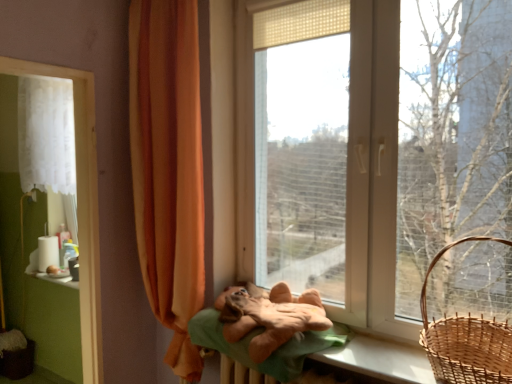
Measure the distance between point (168, 268) and camera.

The depth of point (168, 268) is 7.12 feet.

Measure the distance between transparent plastic window at center and camera.

5.52 feet.

What do you see at coordinates (46, 134) in the screenshot? The height and width of the screenshot is (384, 512). I see `white sheer curtain at left, which appears as the first curtain when viewed from the back` at bounding box center [46, 134].

I want to click on white sheer curtain at left, acting as the second curtain starting from the right, so click(x=46, y=134).

You are a GUI agent. You are given a task and a screenshot of the screen. Output one action in this format:
    pyautogui.click(x=<x>, y=<y>)
    Task: Click on the woven brown basket at right
    
    Given the screenshot: What is the action you would take?
    pyautogui.click(x=466, y=340)

Which is farther, (470,356) or (382,268)?

The point (382,268) is behind.

What's the angular difference between woven brown basket at right and transparent plastic window at center's facing directions?

Result: There is a 0.000102-degree angle between the facing directions of woven brown basket at right and transparent plastic window at center.

From a real-world perspective, relative to transparent plastic window at center, is woven brown basket at right vertically above or below?

In terms of real-world spatial position, woven brown basket at right is below transparent plastic window at center.

Looking at their sizes, would you say woven brown basket at right is wider or thinner than transparent plastic window at center?

Clearly, woven brown basket at right has more width compared to transparent plastic window at center.

Considering the positions of objects orange fabric curtain at left, positioned as the 2th curtain in left-to-right order, and soft brown plush at center in the image provided, who is behind, orange fabric curtain at left, positioned as the 2th curtain in left-to-right order, or soft brown plush at center?

orange fabric curtain at left, positioned as the 2th curtain in left-to-right order, is behind.

Could you tell me if orange fabric curtain at left, the 2th curtain from the back, is turned towards soft brown plush at center?

No, orange fabric curtain at left, the 2th curtain from the back, does not turn towards soft brown plush at center.

Is orange fabric curtain at left, positioned as the 2th curtain in left-to-right order, surrounding soft brown plush at center?

That's incorrect, soft brown plush at center is not inside orange fabric curtain at left, positioned as the 2th curtain in left-to-right order.

You are a GUI agent. You are given a task and a screenshot of the screen. Output one action in this format:
    pyautogui.click(x=<x>, y=<y>)
    Task: Click on the curtain that is the 1st object located above the soft brown plush at center (from the image's perspective)
    This screenshot has width=512, height=384.
    Given the screenshot: What is the action you would take?
    pyautogui.click(x=168, y=168)

From the picture: Does white fabric at left contain woven brown basket at right?

Actually, woven brown basket at right is outside white fabric at left.

From the picture: From the image's perspective, which object appears higher, white fabric at left or woven brown basket at right?

white fabric at left, from the image's perspective.

Does white fabric at left have a greater width compared to woven brown basket at right?

In fact, white fabric at left might be narrower than woven brown basket at right.

Would you say white fabric at left is a long distance from woven brown basket at right?

Yes, white fabric at left and woven brown basket at right are quite far apart.

Looking at this image, is brown woven basket at lower left not inside white fabric at left?

Yes.

Is brown woven basket at lower left positioned behind white fabric at left?

Yes, brown woven basket at lower left is further from the camera.

Is brown woven basket at lower left in contact with white fabric at left?

brown woven basket at lower left is not next to white fabric at left, and they're not touching.

Can you confirm if brown woven basket at lower left is shorter than white fabric at left?

Correct, brown woven basket at lower left is not as tall as white fabric at left.

Is soft brown plush at center next to white fabric at left?

No, soft brown plush at center is not next to white fabric at left.

Considering the sizes of objects soft brown plush at center and white fabric at left in the image provided, who is taller, soft brown plush at center or white fabric at left?

Standing taller between the two is white fabric at left.

Where is `window frame above the soft brown plush at center (from the image's perspective)`? window frame above the soft brown plush at center (from the image's perspective) is located at coordinates (81, 206).

Is point (311, 303) more distant than point (98, 279)?

No.

What's the angular difference between white fabric at left and transparent plastic window at center's facing directions?

white fabric at left and transparent plastic window at center are facing 88.5 degrees away from each other.

From the image's perspective, who appears lower, white fabric at left or transparent plastic window at center?

white fabric at left appears lower in the image.

Are white fabric at left and transparent plastic window at center beside each other?

No.

Which is more to the right, white fabric at left or transparent plastic window at center?

Positioned to the right is transparent plastic window at center.

Considering the relative sizes of transparent plastic window at center and woven brown basket at right in the image provided, is transparent plastic window at center smaller than woven brown basket at right?

Actually, transparent plastic window at center might be larger than woven brown basket at right.

Looking at this image, is transparent plastic window at center wider or thinner than woven brown basket at right?

Clearly, transparent plastic window at center has less width compared to woven brown basket at right.

Is transparent plastic window at center far away from woven brown basket at right?

That's not correct — transparent plastic window at center is a little close to woven brown basket at right.

How different are the orientations of transparent plastic window at center and woven brown basket at right in degrees?

The facing directions of transparent plastic window at center and woven brown basket at right are 0.000102 degrees apart.

In order to click on window above the woven brown basket at right (from the image's perspective) in this screenshot , I will do `click(373, 173)`.

At what (x,y) coordinates should I click in order to perform the action: click on bed that is below the orange fabric curtain at left, positioned as the 2th curtain in left-to-right order (from the image's perspective). Please return your answer as a coordinate pair (x, y). This screenshot has height=384, width=512. Looking at the image, I should click on (267, 330).

Which object lies nearer to the anchor point soft brown plush at center, white fabric at left or white sheer curtain at left, acting as the second curtain starting from the right?

white fabric at left lies closer to soft brown plush at center than the other object.

Based on the photo, considering their positions, is transparent plastic window at center positioned closer to white fabric at left than soft brown plush at center?

soft brown plush at center is positioned closer to the anchor white fabric at left.

Based on their spatial positions, is white fabric at left or soft brown plush at center closer to woven brown basket at right?

soft brown plush at center lies closer to woven brown basket at right than the other object.

Estimate the real-world distances between objects in this image. Which object is closer to brown woven basket at lower left, woven brown basket at right or orange fabric curtain at left, which is counted as the first curtain, starting from the front?

orange fabric curtain at left, which is counted as the first curtain, starting from the front, is closer to brown woven basket at lower left.

Which object lies further to the anchor point brown woven basket at lower left, transparent plastic window at center or soft brown plush at center?

transparent plastic window at center is positioned further to the anchor brown woven basket at lower left.

Looking at the image, which one is located further to brown woven basket at lower left, woven brown basket at right or white fabric at left?

The object further to brown woven basket at lower left is woven brown basket at right.

From the image, which object appears to be farther from soft brown plush at center, white fabric at left or orange fabric curtain at left, the 2th curtain from the back?

white fabric at left lies further to soft brown plush at center than the other object.

Based on their spatial positions, is white fabric at left or brown woven basket at lower left closer to orange fabric curtain at left, the 1th curtain from the right?

white fabric at left.

Where is `bed situated between white fabric at left and transparent plastic window at center from left to right`? The height and width of the screenshot is (384, 512). bed situated between white fabric at left and transparent plastic window at center from left to right is located at coordinates (267, 330).

The width and height of the screenshot is (512, 384). I want to click on curtain located between white sheer curtain at left, acting as the second curtain starting from the right, and transparent plastic window at center in the left-right direction, so click(168, 168).

This screenshot has width=512, height=384. What are the coordinates of `window frame located between white sheer curtain at left, the first curtain from the left, and transparent plastic window at center in the left-right direction` in the screenshot? It's located at (81, 206).

Locate an element on the screen. This screenshot has height=384, width=512. bed situated between brown woven basket at lower left and woven brown basket at right from left to right is located at coordinates (267, 330).